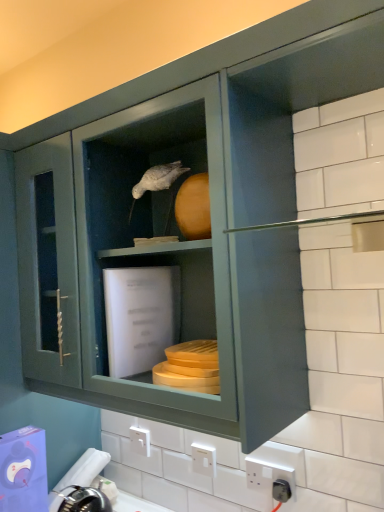
This screenshot has width=384, height=512. In order to click on satin nickel faucet at lower left in this screenshot , I will do `click(85, 469)`.

What is the approximate width of satin nickel faucet at lower left?

It is 9.67 inches.

Describe the element at coordinates (85, 469) in the screenshot. This screenshot has width=384, height=512. I see `satin nickel faucet at lower left` at that location.

The width and height of the screenshot is (384, 512). Identify the location of satin nickel faucet at lower left. (85, 469).